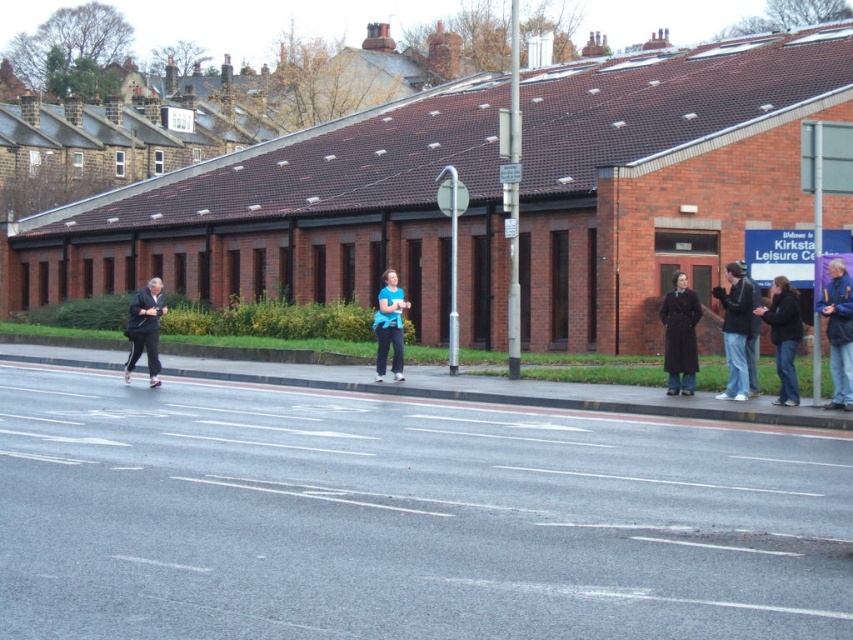
Can you confirm if blue denim jacket at right is positioned to the left of dark blue jacket at right?

No, blue denim jacket at right is not to the left of dark blue jacket at right.

At what (x,y) coordinates should I click in order to perform the action: click on blue denim jacket at right. Please return your answer as a coordinate pair (x, y). This screenshot has width=853, height=640. Looking at the image, I should click on (838, 332).

Locate an element on the screen. blue denim jacket at right is located at coordinates (838, 332).

Which is more to the right, dark blue jeans at right or blue denim jacket at right?

From the viewer's perspective, blue denim jacket at right appears more on the right side.

Who is more forward, (753, 301) or (836, 276)?

Positioned in front is point (836, 276).

Does point (746, 336) lie behind point (836, 404)?

Yes.

The image size is (853, 640). Identify the location of dark blue jeans at right. (735, 330).

Is dark brown leather coat at right below dark gray track pants at left?

Indeed, dark brown leather coat at right is positioned under dark gray track pants at left.

Which is in front, point (666, 333) or point (131, 346)?

Point (666, 333)

Locate an element on the screen. This screenshot has height=640, width=853. dark brown leather coat at right is located at coordinates (680, 336).